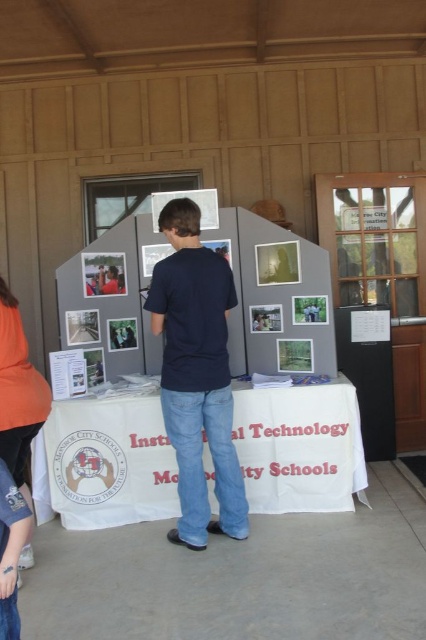
You are standing in front of the display board at the Madrone City Schools event. You notice two points marked on the board. One is at coordinate point (348, 461) and the other at point (8, 452). From your perspective, which point is closer to you?

The point at (348, 461) is closer to you because it is further to the viewer than the point at (8, 452).

You are organizing a presentation and need to decide which fabric to use for a backdrop. The white cloth at center and orange fabric at lower left are available. Which fabric would you choose if you want a larger backdrop?

The white cloth at center is larger in size than the orange fabric at lower left, so it would be the better choice for a larger backdrop.

What object is located at the coordinates point (x=273, y=292)?

The matte gray posterboard at center is located at point (x=273, y=292).